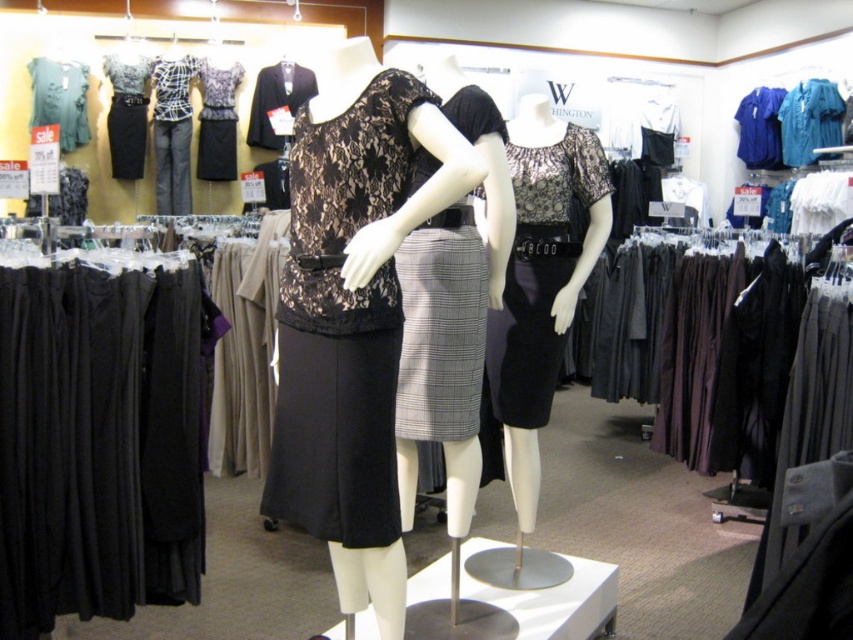
You are a customer in the clothing store and want to try on the lace fabric dress at center and the gray wool skirt at center. The fitting room is 12 inches wide. Can both items fit side by side inside the fitting room?

The lace fabric dress at center and gray wool skirt at center are 10.95 inches apart, so they can fit side by side in the 12 inch wide fitting room since the total space required is less than the available width.

You are a customer in the store and want to see the blue jersey at upper right. Can you see it clearly from your current position in front of the teal satin blouse at upper right?

The teal satin blouse at upper right is in front of the blue jersey at upper right, so the blue jersey at upper right might be partially or fully blocked from view by the teal satin blouse at upper right.

You are standing in the women section of the clothing store and want to know which of the two points, point (781, 124) or point (769, 118), is closer to you. Can you tell me?

Point (781, 124) is closer to the viewer than point (769, 118).